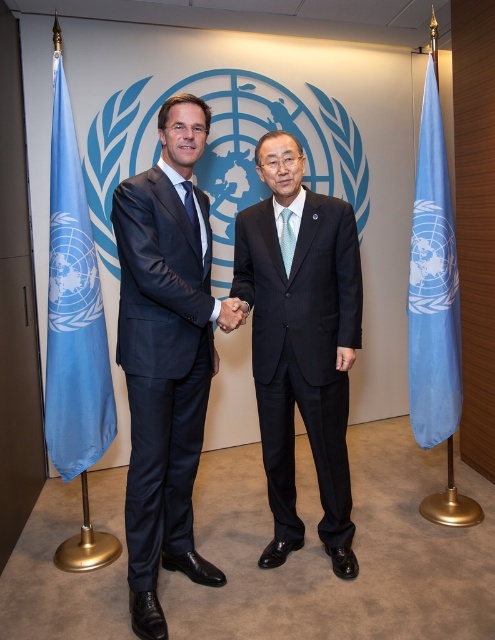
Based on the scene description, where is the blue fabric flag at left positioned in terms of coordinates?

The blue fabric flag at left is positioned at coordinates [73,308].

You are a photographer positioned in front of the two individuals shaking hands. You need to capture a photo where both the blue fabric flag at left and the light blue silk tie at center are clearly visible. Given their sizes, which object will appear larger in the photo?

The blue fabric flag at left will appear larger in the photo because it is much taller than the light blue silk tie at center.

You are a photographer standing in front of the two blue fabric flags. Which flag is nearer to you, the blue fabric flag at left or the blue fabric flag at right?

The blue fabric flag at left is closer to the viewer than the blue fabric flag at right.